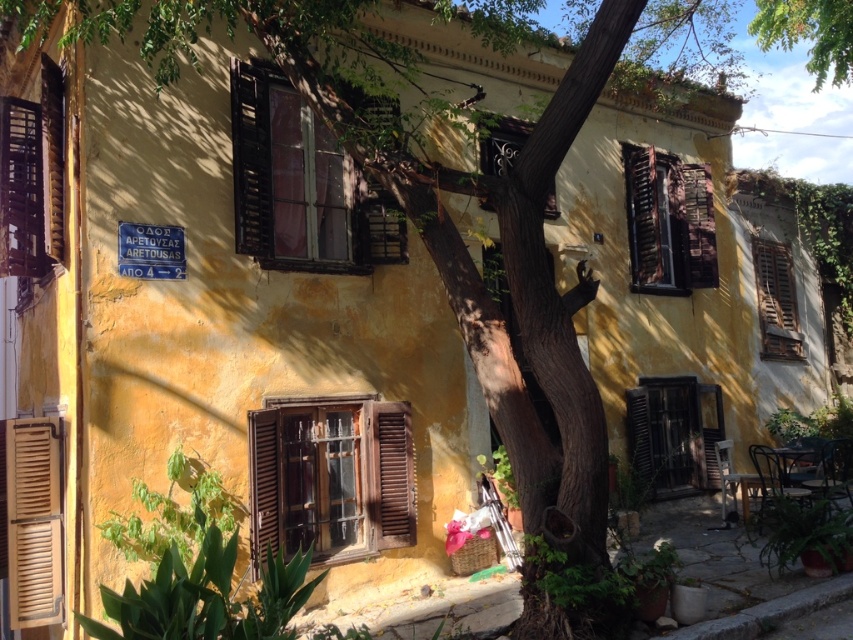
Which is behind, point (26, 579) or point (785, 285)?

The point (785, 285) is more distant.

From the picture: Which is more to the right, wooden at left or wooden shutters at right?

wooden shutters at right is more to the right.

Is point (48, 518) behind point (801, 352)?

No.

Locate an element on the screen. The image size is (853, 640). wooden at left is located at coordinates (33, 522).

Does wooden shutters at center appear under wooden shutters at right?

No, wooden shutters at center is not below wooden shutters at right.

Consider the image. Is wooden shutters at center in front of wooden shutters at right?

That is True.

Which is behind, point (314, 209) or point (781, 314)?

Point (781, 314)

Where is `wooden shutters at center`? The width and height of the screenshot is (853, 640). wooden shutters at center is located at coordinates (300, 186).

Is point (315, 484) more distant than point (703, 196)?

That is False.

Can you confirm if brown wooden shutters at center is smaller than wooden shutters at upper right?

Yes, brown wooden shutters at center is smaller than wooden shutters at upper right.

You are a GUI agent. You are given a task and a screenshot of the screen. Output one action in this format:
    pyautogui.click(x=<x>, y=<y>)
    Task: Click on the brown wooden shutters at center
    
    Given the screenshot: What is the action you would take?
    pyautogui.click(x=329, y=480)